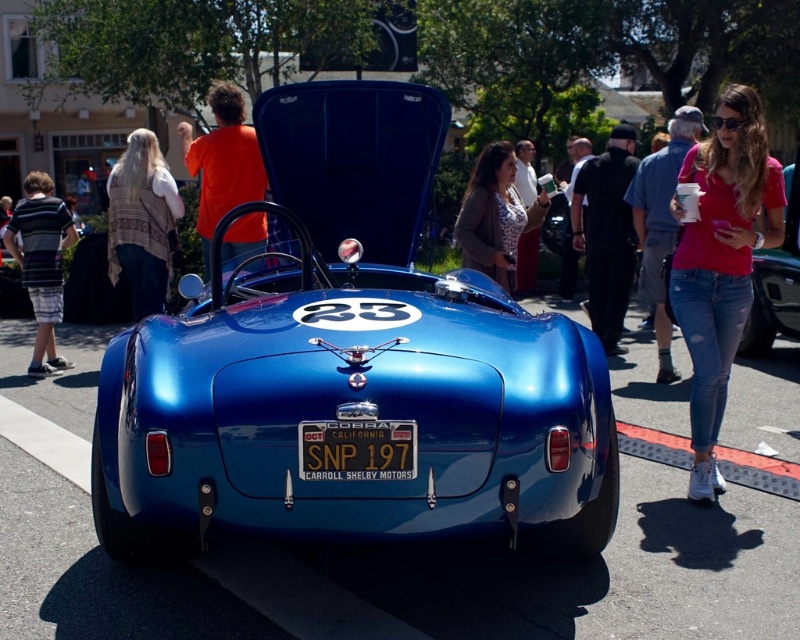
You are standing at the left edge of the image and want to walk to the pink cotton shirt at right. Which direction should you move relative to the shiny blue car at center?

Since the shiny blue car at center is to the left of the pink cotton shirt at right, you should move to the right of the shiny blue car at center to reach the pink cotton shirt at right.

You are a photographer standing near the metallic blue car at center and want to take a photo of the pink cotton shirt at right without any obstructions. Given that the distance between them is 10.68 feet, can you estimate if you can capture both subjects in a single frame without moving the camera?

The pink cotton shirt at right and metallic blue car at center are 10.68 feet apart. Depending on the camera lens used, capturing both subjects in a single frame may be possible if the lens has a wide enough angle to cover the 10.68 feet distance between them.